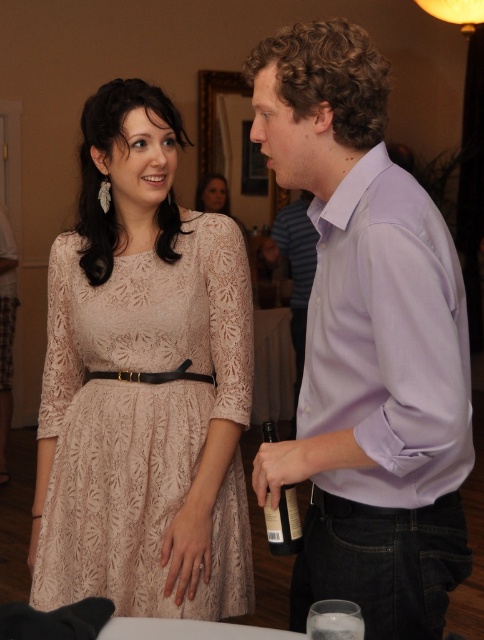
You are at a party and need to locate two shirts. The lavender cotton shirt at right and the purple cotton shirt at center. Which one is positioned to the left?

The lavender cotton shirt at right is to the left of the purple cotton shirt at center.

You are a photographer standing at the camera position. You want to take a closeup shot of the lace fabric dress at left without moving the camera. Is it possible to do so given the current distance?

The lace fabric dress at left is 5.44 feet from camera, so yes, it is possible to take a closeup shot without moving the camera as the distance allows for zooming in.